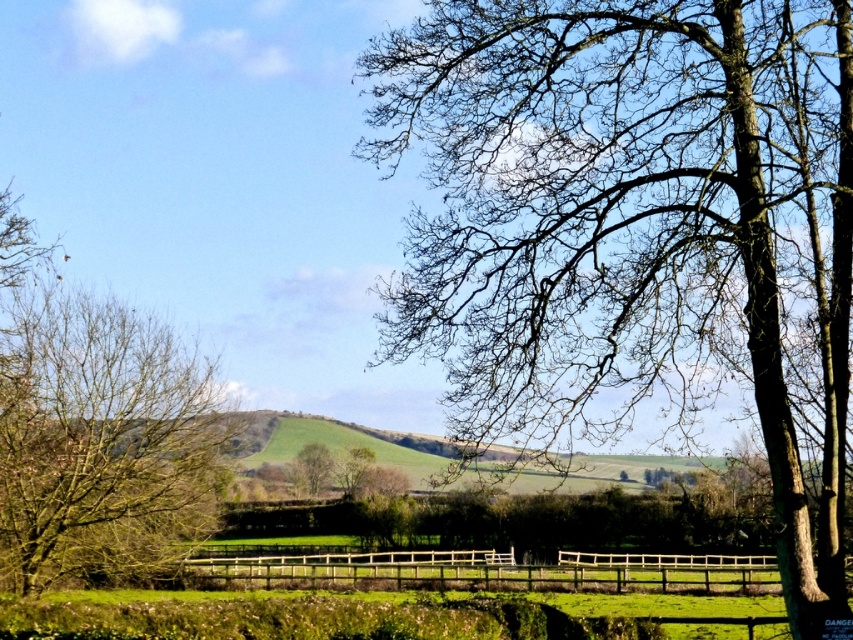
Question: Can you confirm if wooden fence at center is thinner than green matte tree at center?

Choices:
 (A) no
 (B) yes

Answer: (A)

Question: Can you confirm if wooden fence at center is thinner than green matte tree at center?

Choices:
 (A) no
 (B) yes

Answer: (A)

Question: Which object is the closest to the wooden fence at center?

Choices:
 (A) green matte tree at center
 (B) bare branches at left

Answer: (A)

Question: Which of the following is the farthest from the observer?

Choices:
 (A) (762, 557)
 (B) (310, 474)

Answer: (A)

Question: Does bare branches at left come in front of green matte tree at center?

Choices:
 (A) no
 (B) yes

Answer: (B)

Question: Which point is farther from the camera taking this photo?

Choices:
 (A) (757, 300)
 (B) (314, 474)
 (C) (596, 573)
 (D) (173, 552)

Answer: (C)